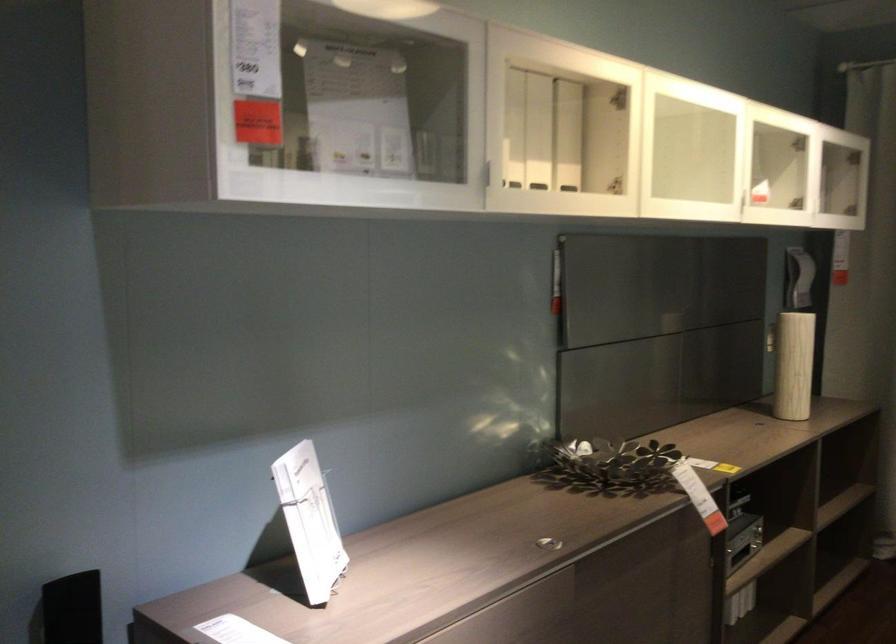
Which object does [538,131] point to?

This point indicates the white sign holder.